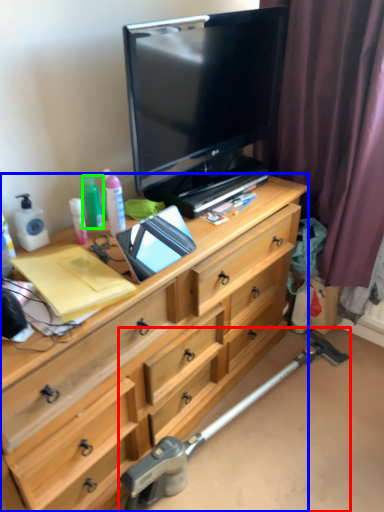
Question: Considering the real-world distances, which object is closest to crutch (highlighted by a red box)? chest of drawers (highlighted by a blue box) or bottle (highlighted by a green box).

Choices:
 (A) chest of drawers
 (B) bottle

Answer: (A)